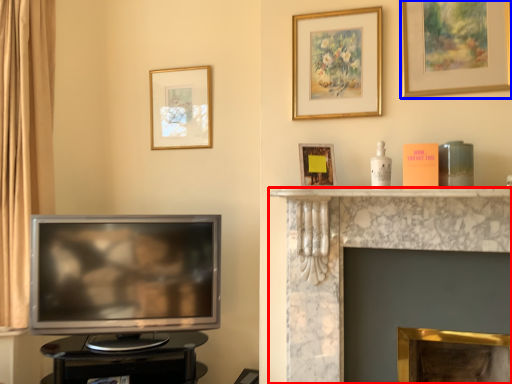
Question: Which of the following is the farthest to the observer, fireplace (highlighted by a red box) or picture frame (highlighted by a blue box)?

Choices:
 (A) fireplace
 (B) picture frame

Answer: (B)